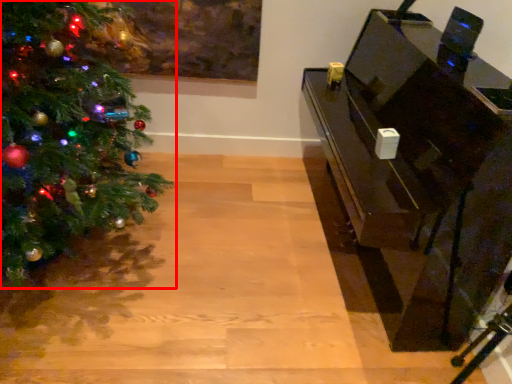
Question: Considering the relative positions of christmas tree (annotated by the red box) and furniture in the image provided, where is christmas tree (annotated by the red box) located with respect to the staircase?

Choices:
 (A) left
 (B) right

Answer: (A)